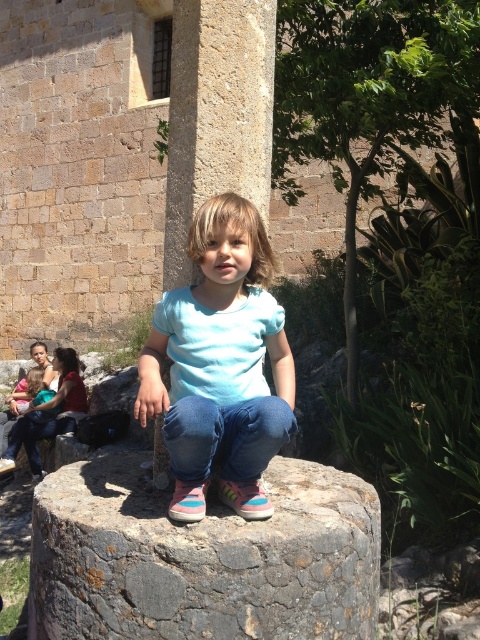
You are a photographer trying to capture the light blue cotton shirt at center in your shot. The camera is positioned at the same level as the shirt. Which direction should you move the camera to frame the shirt better, based on its coordinates?

The light blue cotton shirt at center is located at point coordinates, so you should adjust the camera to center the shirt within the frame by moving it towards the shirt until it aligns with the desired position.

Where is the rusty stone boulder at center located in the image?

The rusty stone boulder at center is located at point (202, 557) in the image.